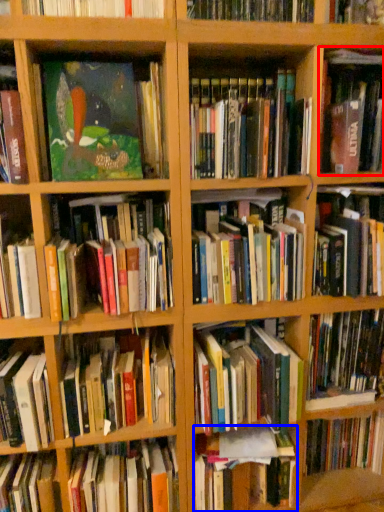
Question: Among these objects, which one is nearest to the camera, book (highlighted by a red box) or book (highlighted by a blue box)?

Choices:
 (A) book
 (B) book

Answer: (A)